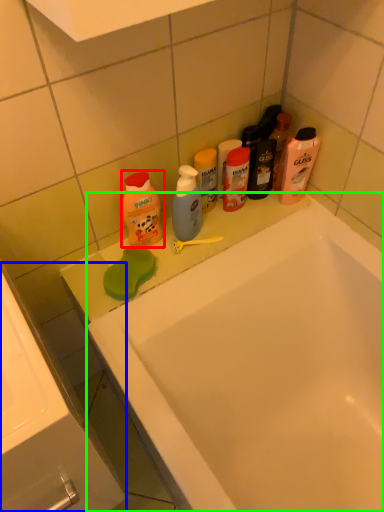
Question: Which object is positioned closest to cleaning product (highlighted by a red box)? Select from sink (highlighted by a blue box) and bathtub (highlighted by a green box).

Choices:
 (A) sink
 (B) bathtub

Answer: (B)